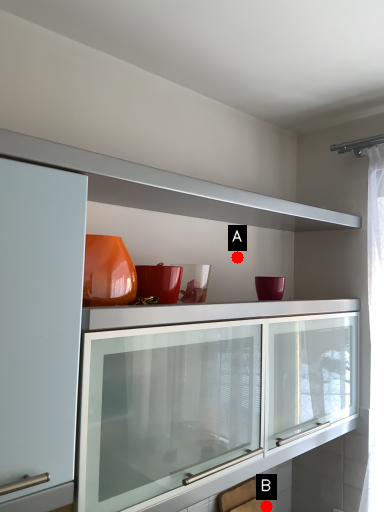
Question: Two points are circled on the image, labeled by A and B beside each circle. Which point is farther to the camera?

Choices:
 (A) A is further
 (B) B is further

Answer: (B)